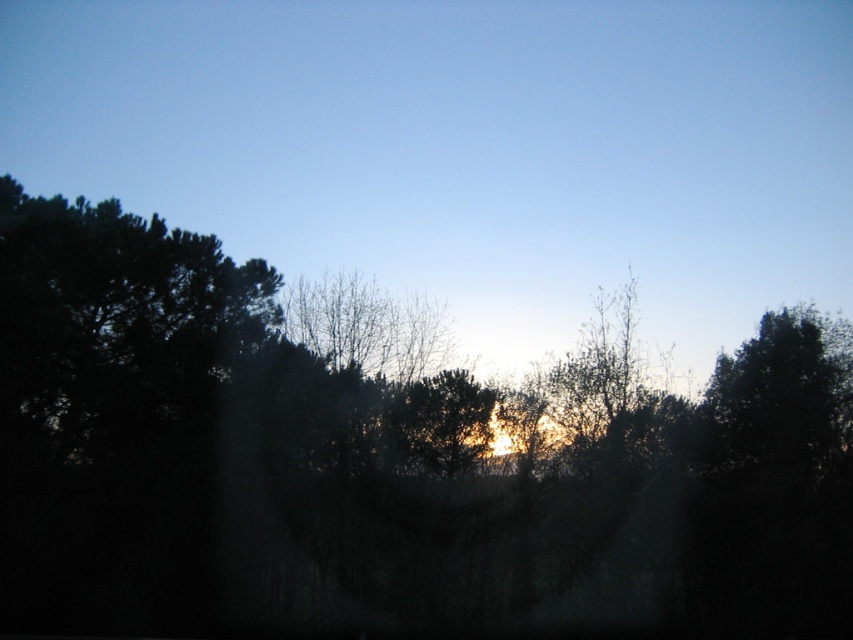
Does dark green leafy tree at center have a lesser height compared to golden light at center?

Correct, dark green leafy tree at center is not as tall as golden light at center.

Which is behind, point (850, 561) or point (318, 248)?

The point (318, 248) is more distant.

You are a GUI agent. You are given a task and a screenshot of the screen. Output one action in this format:
    pyautogui.click(x=<x>, y=<y>)
    Task: Click on the dark green leafy tree at center
    The width and height of the screenshot is (853, 640).
    Given the screenshot: What is the action you would take?
    pyautogui.click(x=387, y=461)